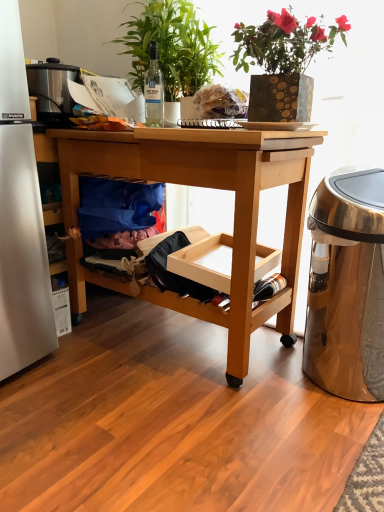
Question: Considering the relative sizes of gold-patterned pot at upper center, the second houseplant in the left-to-right sequence, and green leafy plant at upper center, which is counted as the 1th houseplant, starting from the left, in the image provided, is gold-patterned pot at upper center, the second houseplant in the left-to-right sequence, bigger than green leafy plant at upper center, which is counted as the 1th houseplant, starting from the left,?

Choices:
 (A) yes
 (B) no

Answer: (B)

Question: Does gold-patterned pot at upper center, the 1th houseplant from the right, have a lesser width compared to green leafy plant at upper center, which is counted as the 1th houseplant, starting from the left?

Choices:
 (A) yes
 (B) no

Answer: (B)

Question: Is gold-patterned pot at upper center, the second houseplant in the left-to-right sequence, not within green leafy plant at upper center, the second houseplant in the right-to-left sequence?

Choices:
 (A) no
 (B) yes

Answer: (B)

Question: Does gold-patterned pot at upper center, the second houseplant in the left-to-right sequence, have a greater height compared to green leafy plant at upper center, which is counted as the 1th houseplant, starting from the left?

Choices:
 (A) yes
 (B) no

Answer: (B)

Question: Is gold-patterned pot at upper center, the 1th houseplant from the right, at the right side of green leafy plant at upper center, the second houseplant in the right-to-left sequence?

Choices:
 (A) no
 (B) yes

Answer: (B)

Question: From the image's perspective, is gold-patterned pot at upper center, the 1th houseplant from the right, located above green leafy plant at upper center, which is counted as the 1th houseplant, starting from the left?

Choices:
 (A) yes
 (B) no

Answer: (B)

Question: Considering the relative sizes of clear glass bottle at center, the first bottle in the top-to-bottom sequence, and natural wood desk at center in the image provided, is clear glass bottle at center, the first bottle in the top-to-bottom sequence, bigger than natural wood desk at center?

Choices:
 (A) yes
 (B) no

Answer: (B)

Question: From the image's perspective, is clear glass bottle at center, the second bottle when ordered from right to left, located above natural wood desk at center?

Choices:
 (A) no
 (B) yes

Answer: (B)

Question: Considering the relative sizes of clear glass bottle at center, the second bottle when ordered from right to left, and natural wood desk at center in the image provided, is clear glass bottle at center, the second bottle when ordered from right to left, shorter than natural wood desk at center?

Choices:
 (A) no
 (B) yes

Answer: (B)

Question: Is clear glass bottle at center, the first bottle in the top-to-bottom sequence, surrounding natural wood desk at center?

Choices:
 (A) no
 (B) yes

Answer: (A)

Question: Is clear glass bottle at center, which is the first bottle from left to right, behind natural wood desk at center?

Choices:
 (A) yes
 (B) no

Answer: (A)

Question: Is the surface of clear glass bottle at center, which is the first bottle from left to right, in direct contact with natural wood desk at center?

Choices:
 (A) no
 (B) yes

Answer: (A)

Question: Is translucent glass bottle at lower right, the first bottle when ordered from bottom to top, located outside blue fabric bag at lower left?

Choices:
 (A) yes
 (B) no

Answer: (A)